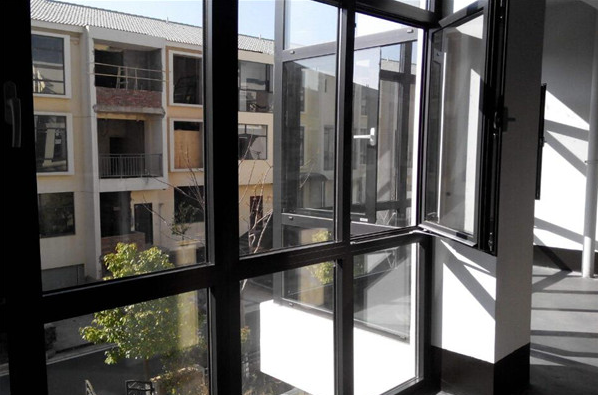
Image resolution: width=598 pixels, height=395 pixels. Find the location of `handle`. handle is located at coordinates (373, 139), (509, 116).